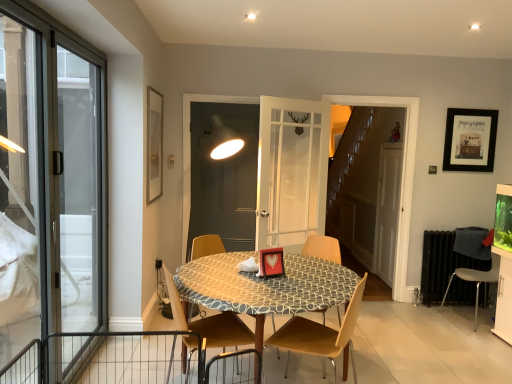
The width and height of the screenshot is (512, 384). What are the coordinates of `wooden stairs at center` in the screenshot? It's located at (360, 179).

The image size is (512, 384). Describe the element at coordinates (360, 179) in the screenshot. I see `wooden stairs at center` at that location.

What is the approximate width of wooden chair at center, which is counted as the 3th chair, starting from the left?

19.15 inches.

How much space does wooden chair at center, which appears as the 3th chair when viewed from the right, occupy vertically?

85.93 centimeters.

From the picture: In order to face wooden chair at center, the second chair in the left-to-right sequence, should I rotate leftwards or rightwards?

Rotate left and turn 4.182 degrees.

This screenshot has height=384, width=512. I want to click on black metallic radiator at lower right, so click(x=442, y=264).

Identify the location of wooden stairs at center. This screenshot has height=384, width=512. (360, 179).

Which of these two, wooden stairs at center or transparent glass door at left, the 2th window viewed from the back, stands taller?

wooden stairs at center.

Could you tell me if wooden stairs at center is turned towards transparent glass door at left, the first window in the front-to-back sequence?

No, wooden stairs at center is not facing towards transparent glass door at left, the first window in the front-to-back sequence.

From the image's perspective, which is below, wooden stairs at center or transparent glass door at left, the 2th window viewed from the back?

transparent glass door at left, the 2th window viewed from the back.

Can we say gray fabric chair at lower right, placed as the 4th chair when sorted from left to right, lies outside wooden stairs at center?

Yes, gray fabric chair at lower right, placed as the 4th chair when sorted from left to right, is located beyond the bounds of wooden stairs at center.

Is gray fabric chair at lower right, placed as the 4th chair when sorted from left to right, oriented away from wooden stairs at center?

No, wooden stairs at center is not at the back of gray fabric chair at lower right, placed as the 4th chair when sorted from left to right.

Who is taller, gray fabric chair at lower right, the first chair in the right-to-left sequence, or wooden stairs at center?

With more height is wooden stairs at center.

Is gray fabric chair at lower right, placed as the 4th chair when sorted from left to right, not near wooden stairs at center?

Yes, gray fabric chair at lower right, placed as the 4th chair when sorted from left to right, is far from wooden stairs at center.

From the image's perspective, is wooden chair at center, the second chair in the left-to-right sequence, on top of wooden chair at center, the 1th chair in the left-to-right sequence?

Yes.

There is a wooden chair at center, the second chair in the left-to-right sequence. Where is `the 2nd chair below it (from the image's perspective)`? the 2nd chair below it (from the image's perspective) is located at coordinates pos(209,322).

From a real-world perspective, relative to wooden chair at center, the 1th chair in the left-to-right sequence, is wooden chair at center, which appears as the 3th chair when viewed from the right, vertically above or below?

Clearly, from a real-world perspective, wooden chair at center, which appears as the 3th chair when viewed from the right, is above wooden chair at center, the 1th chair in the left-to-right sequence.

Looking at this image, is wooden chair at center, which appears as the 3th chair when viewed from the right, to the left or to the right of wooden chair at center, acting as the 4th chair starting from the right, in the image?

Based on their positions, wooden chair at center, which appears as the 3th chair when viewed from the right, is located to the right of wooden chair at center, acting as the 4th chair starting from the right.

From the image's perspective, is matte gold picture frame at upper left, which appears as the first picture frame when viewed from the front, located above wooden chair at center, the 2th chair viewed from the right?

Correct, matte gold picture frame at upper left, which appears as the first picture frame when viewed from the front, appears higher than wooden chair at center, the 2th chair viewed from the right, in the image.

Is there a large distance between matte gold picture frame at upper left, arranged as the first picture frame when viewed from the left, and wooden chair at center, which is counted as the 3th chair, starting from the left?

Yes, matte gold picture frame at upper left, arranged as the first picture frame when viewed from the left, and wooden chair at center, which is counted as the 3th chair, starting from the left, are quite far apart.

Where is `the 1st picture frame behind the wooden chair at center, which is counted as the 3th chair, starting from the left, counting from the anchor's position`? The image size is (512, 384). the 1st picture frame behind the wooden chair at center, which is counted as the 3th chair, starting from the left, counting from the anchor's position is located at coordinates (154, 145).

In the scene shown: From a real-world perspective, is matte gold picture frame at upper left, which appears as the first picture frame when viewed from the front, physically above wooden chair at center, the 2th chair viewed from the right?

Correct, in the physical world, matte gold picture frame at upper left, which appears as the first picture frame when viewed from the front, is higher than wooden chair at center, the 2th chair viewed from the right.

From a real-world perspective, is patterned fabric table at center physically above transparent glass door at left, the first window in the front-to-back sequence?

No, from a real-world perspective, patterned fabric table at center is not over transparent glass door at left, the first window in the front-to-back sequence

Is patterned fabric table at center surrounding transparent glass door at left, the 2th window viewed from the back?

No, transparent glass door at left, the 2th window viewed from the back, is located outside of patterned fabric table at center.

Which of these two, patterned fabric table at center or transparent glass door at left, the 2th window viewed from the back, is bigger?

patterned fabric table at center is bigger.

Considering the positions of points (191, 270) and (15, 299), is point (191, 270) farther from camera compared to point (15, 299)?

Yes, point (191, 270) is farther from viewer.

Can you confirm if transparent glass door at left is taller than gray fabric chair at lower right, placed as the 4th chair when sorted from left to right?

Yes.

Where is `the 4th chair to the right of the transparent glass door at left, starting your count from the anchor`? the 4th chair to the right of the transparent glass door at left, starting your count from the anchor is located at coordinates (476, 281).

Is transparent glass door at left oriented away from gray fabric chair at lower right, placed as the 4th chair when sorted from left to right?

transparent glass door at left is not turned away from gray fabric chair at lower right, placed as the 4th chair when sorted from left to right.

Is transparent glass door at left wider or thinner than gray fabric chair at lower right, placed as the 4th chair when sorted from left to right?

transparent glass door at left is thinner than gray fabric chair at lower right, placed as the 4th chair when sorted from left to right.

Is wooden chair at center, which is counted as the 3th chair, starting from the left, in contact with matte gold picture frame at upper left, positioned as the second picture frame in back-to-front order?

No, wooden chair at center, which is counted as the 3th chair, starting from the left, is not touching matte gold picture frame at upper left, positioned as the second picture frame in back-to-front order.

Could you tell me if wooden chair at center, which is counted as the 3th chair, starting from the left, is facing matte gold picture frame at upper left, which appears as the first picture frame when viewed from the front?

No, wooden chair at center, which is counted as the 3th chair, starting from the left, is not oriented towards matte gold picture frame at upper left, which appears as the first picture frame when viewed from the front.

This screenshot has height=384, width=512. Find the location of `elevator behind the transparent glass door at left, the first window in the front-to-back sequence`. elevator behind the transparent glass door at left, the first window in the front-to-back sequence is located at coordinates (360, 179).

You are a GUI agent. You are given a task and a screenshot of the screen. Output one action in this format:
    pyautogui.click(x=<x>, y=<y>)
    Task: Click on the chair on the right of wooden stairs at center
    This screenshot has height=384, width=512.
    Given the screenshot: What is the action you would take?
    pyautogui.click(x=476, y=281)

Considering their positions, is matte black picture frame at upper right, placed as the first picture frame when sorted from back to front, positioned further to matte gray screen door at center, which ranks as the second screen door in back-to-front order, than transparent glass door at left, which is the first window from back to front?

The object further to matte gray screen door at center, which ranks as the second screen door in back-to-front order, is matte black picture frame at upper right, placed as the first picture frame when sorted from back to front.

Looking at the image, which one is located closer to black metallic radiator at lower right, transparent glass door at left, the first window in the front-to-back sequence, or matte gold picture frame at upper left, positioned as the second picture frame in back-to-front order?

A: matte gold picture frame at upper left, positioned as the second picture frame in back-to-front order.

When comparing their distances from wooden chair at center, the second chair in the left-to-right sequence, does wooden chair at center, acting as the 4th chair starting from the right, or wooden stairs at center seem further?

wooden stairs at center lies further to wooden chair at center, the second chair in the left-to-right sequence, than the other object.

Estimate the real-world distances between objects in this image. Which object is closer to gray fabric chair at lower right, placed as the 4th chair when sorted from left to right, transparent glass door at left, which is the first window from back to front, or matte gray screen door at center, which is the 1th screen door from front to back?

matte gray screen door at center, which is the 1th screen door from front to back, lies closer to gray fabric chair at lower right, placed as the 4th chair when sorted from left to right, than the other object.

Which object lies nearer to the anchor point transparent glass door at left, the second window viewed from the front, gray fabric chair at lower right, the first chair in the right-to-left sequence, or patterned fabric table at center?

The object closer to transparent glass door at left, the second window viewed from the front, is patterned fabric table at center.

From the image, which object appears to be nearer to transparent glass door at left, the 2th window viewed from the back, matte black picture frame at upper right, positioned as the second picture frame in left-to-right order, or gray fabric chair at lower right, placed as the 4th chair when sorted from left to right?

gray fabric chair at lower right, placed as the 4th chair when sorted from left to right, lies closer to transparent glass door at left, the 2th window viewed from the back, than the other object.

When comparing their distances from patterned fabric table at center, does matte gold picture frame at upper left, positioned as the second picture frame in back-to-front order, or matte black picture frame at upper right, arranged as the first picture frame when viewed from the right, seem closer?

Based on the image, matte gold picture frame at upper left, positioned as the second picture frame in back-to-front order, appears to be nearer to patterned fabric table at center.

Which object lies nearer to the anchor point wooden chair at center, the second chair in the left-to-right sequence, wooden chair at center, which is counted as the 3th chair, starting from the left, or patterned fabric table at center?

The object closer to wooden chair at center, the second chair in the left-to-right sequence, is patterned fabric table at center.

Locate an element on the screen. kitchen & dining room table between wooden chair at center, which is counted as the 3th chair, starting from the left, and wooden chair at center, the second chair in the left-to-right sequence, from front to back is located at coordinates (264, 286).

The width and height of the screenshot is (512, 384). In order to click on window situated between transparent glass door at left and gray fabric chair at lower right, placed as the 4th chair when sorted from left to right, from left to right in this screenshot , I will do `click(19, 188)`.

Find the location of a particular element. picture frame located between wooden chair at center, the 2th chair viewed from the right, and wooden stairs at center in the depth direction is located at coordinates (154, 145).

At what (x,y) coordinates should I click in order to perform the action: click on screen door between wooden chair at center, the second chair in the left-to-right sequence, and black metallic radiator at lower right, in the horizontal direction. Please return your answer as a coordinate pair (x, y). The image size is (512, 384). Looking at the image, I should click on (387, 210).